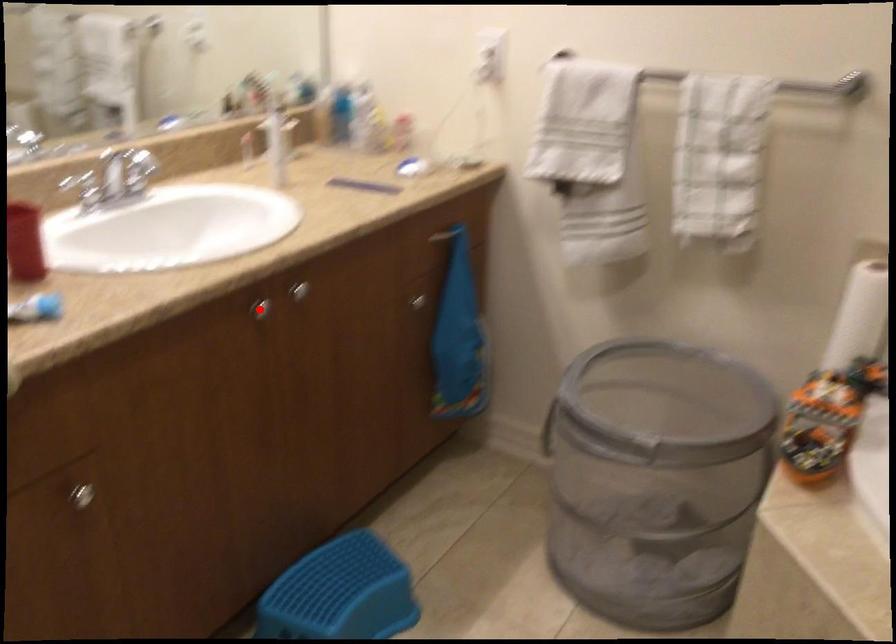
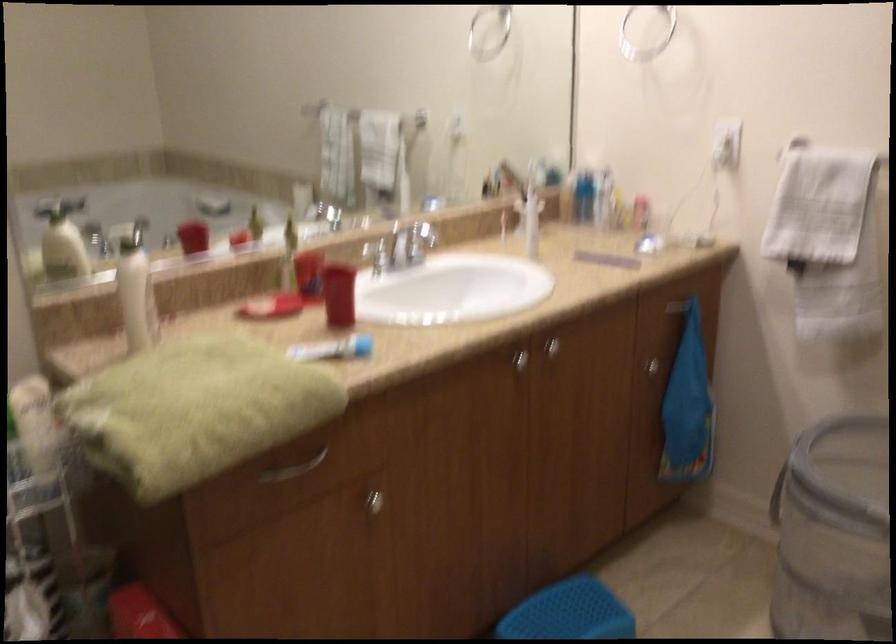
Question: I am providing you with two images of the same scene from different viewpoints. Given a red point in image1, look at the same physical point in image2. Is it:

Choices:
 (A) Closer to the viewpoint
 (B) Farther from the viewpoint

Answer: (B)